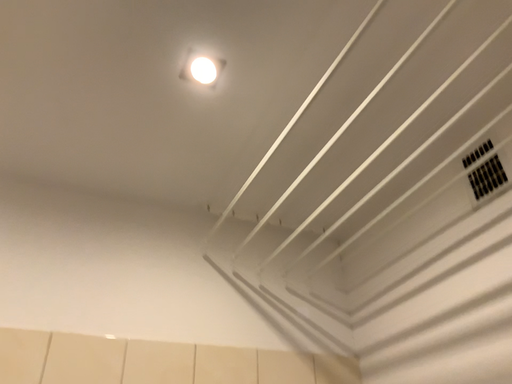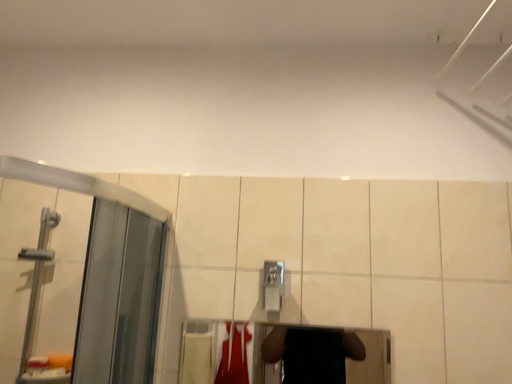
Question: How did the camera likely rotate when shooting the video?

Choices:
 (A) rotated left
 (B) rotated right

Answer: (A)